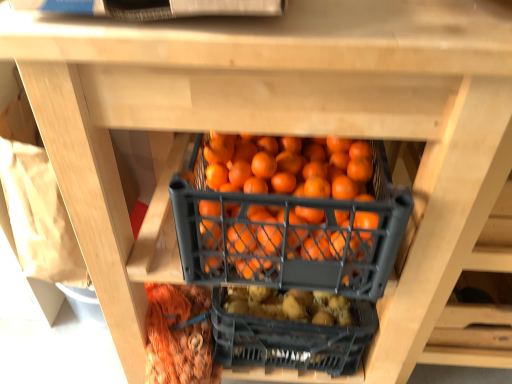
Image resolution: width=512 pixels, height=384 pixels. Find the location of `vacant region above shiny orange peels at lower center (from a real-world perspective)`. vacant region above shiny orange peels at lower center (from a real-world perspective) is located at coordinates (182, 327).